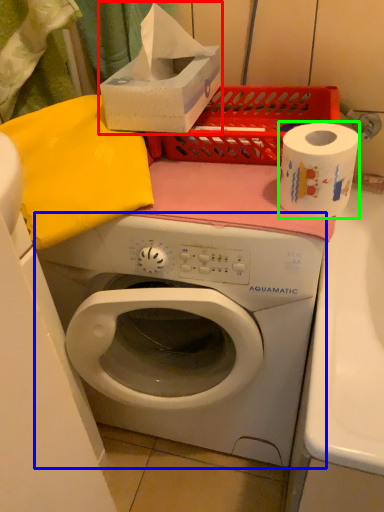
Question: Which is farther away from box (highlighted by a red box)? washing machine (highlighted by a blue box) or paper towel (highlighted by a green box)?

Choices:
 (A) washing machine
 (B) paper towel

Answer: (A)